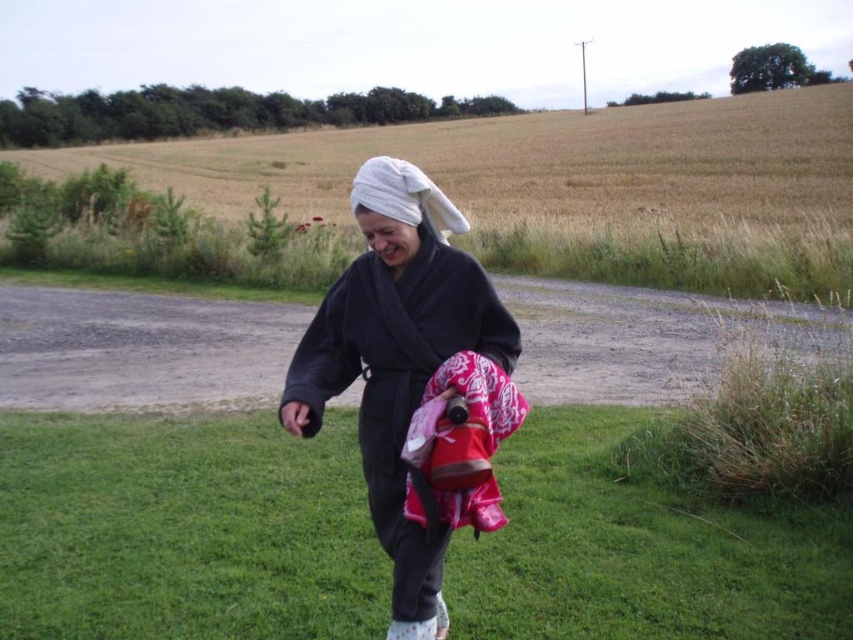
You are an observer standing in the field. You see the dark gray bathrobe at center and the white towel at center. Which object is shorter?

The dark gray bathrobe at center is shorter than the white towel at center.